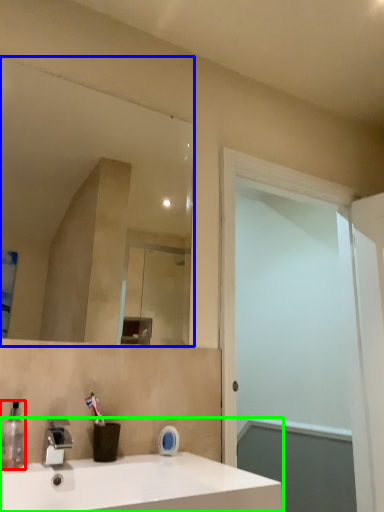
Question: Which object is positioned closest to soap dispenser (highlighted by a red box)? Select from mirror (highlighted by a blue box) and sink (highlighted by a green box).

Choices:
 (A) mirror
 (B) sink

Answer: (B)